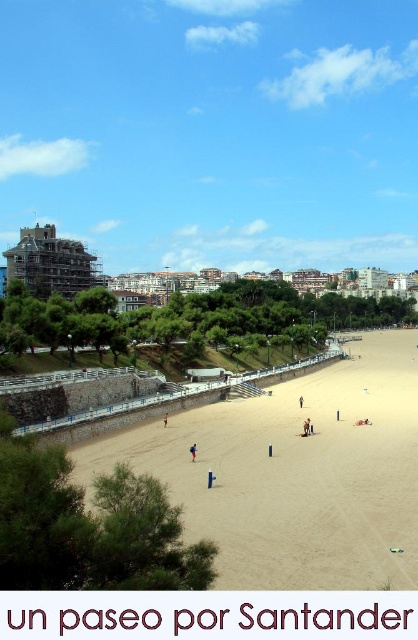
You are a beachgoer carrying a 20 meter long rope. You want to secure your bright blue fabric at center to the light brown sand at center. Is the rope long enough to reach between them?

The light brown sand at center and bright blue fabric at center are 23.22 meters apart from each other. Since the rope is only 20 meters long, it is not long enough to reach between them.

You are a photographer standing on the beach. You want to take a photo that includes both the tan skin person at center and the brown sand at center. Which object will appear larger in the photo?

The tan skin person at center will appear larger in the photo because they are much taller than the brown sand at center.